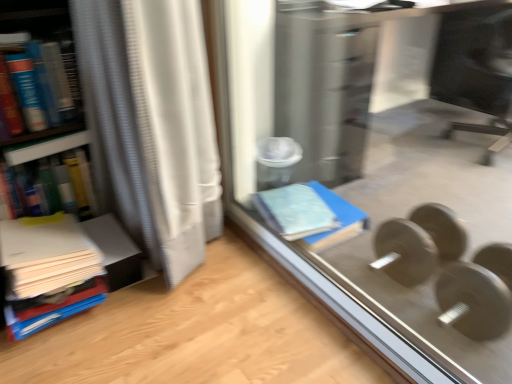
Identify the location of free space behind metallic gray dumbbell at lower right, which is counted as the second dumbbell, starting from the front. (398, 225).